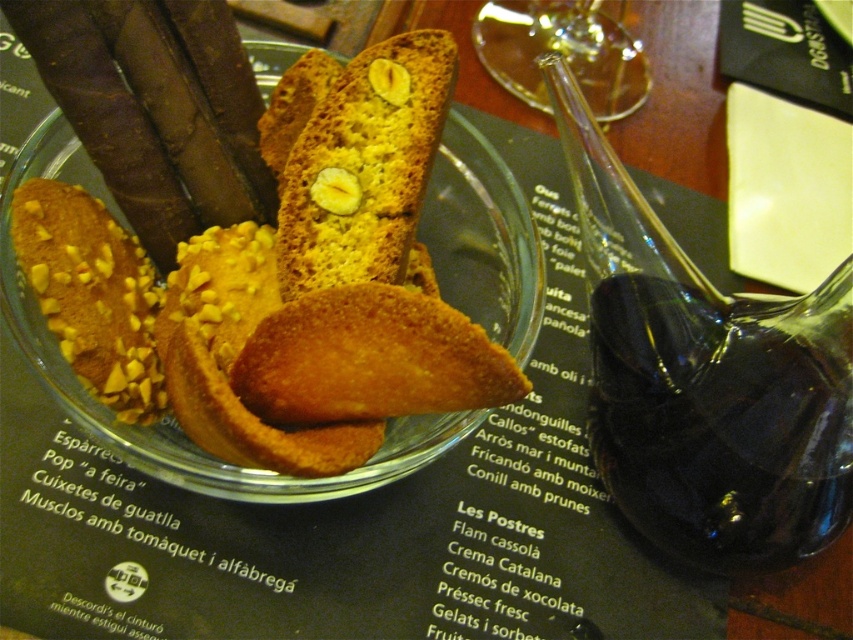
Who is positioned more to the left, golden crumbly biscuit at center or transparent glass at upper center?

golden crumbly biscuit at center

Is point (473, 141) positioned behind point (630, 51)?

No, it is in front of (630, 51).

Who is more distant from viewer, (498, 164) or (480, 54)?

The point (480, 54) is behind.

What are the coordinates of `golden crumbly biscuit at center` in the screenshot? It's located at (219, 385).

Is golden crumbly biscotti at center shorter than transparent glass at upper center?

Incorrect, golden crumbly biscotti at center's height does not fall short of transparent glass at upper center's.

Does golden crumbly biscotti at center have a larger size compared to transparent glass at upper center?

No.

Who is more forward, (325, 116) or (593, 52)?

Point (325, 116) is more forward.

Image resolution: width=853 pixels, height=640 pixels. What are the coordinates of `golden crumbly biscotti at center` in the screenshot? It's located at (364, 164).

Who is positioned more to the right, golden crumbly biscuit at center or golden crumbly biscotti at center?

Positioned to the right is golden crumbly biscotti at center.

Where is `golden crumbly biscuit at center`? This screenshot has width=853, height=640. golden crumbly biscuit at center is located at coordinates (219, 385).